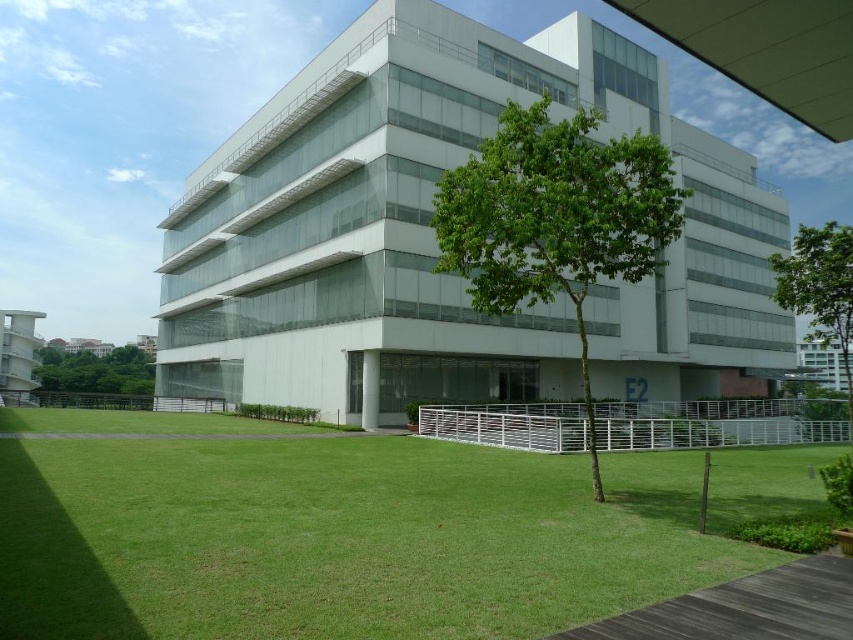
You are standing at the entrance of the building and want to reach a specific point marked as point (846,273). If your walking speed is 3 feet per second, how many seconds will it take you to reach that point?

The distance between you and point (846,273) is 70.63 feet. At a walking speed of 3 feet per second, it will take approximately 23.54 seconds to reach the point.

You are a landscape architect planning to place a new bench in the grassy area between the green leafy tree at right and the green leafy tree at lower left. Based on their positions, which tree is closer to the building?

The green leafy tree at lower left is closer to the building because it is positioned below the green leafy tree at right, meaning it is nearer to the structure.